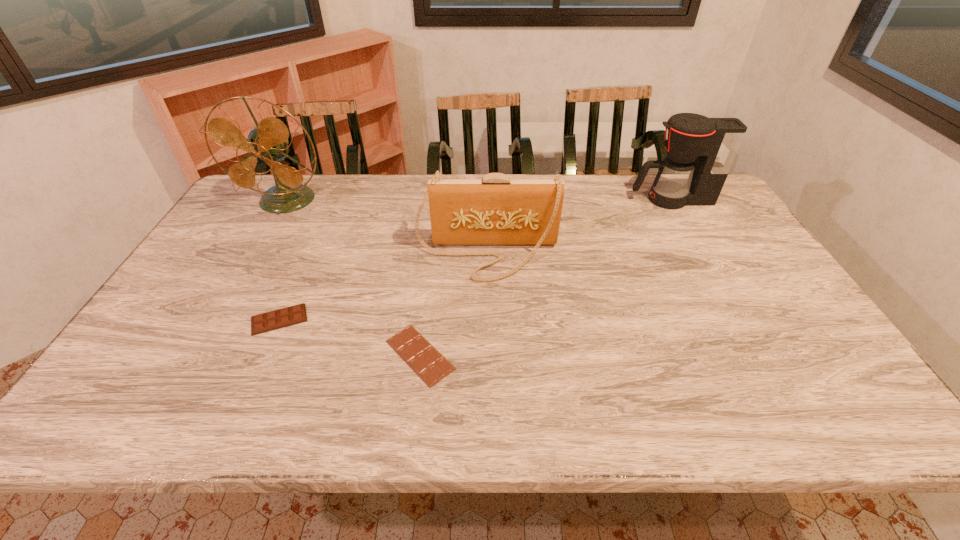
The image size is (960, 540). I want to click on object that is at the right edge, so click(700, 151).

Identify the location of object located in the far left corner section of the desktop. The image size is (960, 540). (268, 140).

Locate an element on the screen. The height and width of the screenshot is (540, 960). object that is positioned at the far right corner is located at coordinates (700, 151).

Locate an element on the screen. Image resolution: width=960 pixels, height=540 pixels. free region at the far edge of the desktop is located at coordinates (376, 202).

In the image, there is a desktop. At what (x,y) coordinates should I click in order to perform the action: click on vacant space at the near edge. Please return your answer as a coordinate pair (x, y). Looking at the image, I should click on (402, 395).

Locate an element on the screen. The image size is (960, 540). free location at the left edge is located at coordinates (157, 387).

I want to click on vacant space at the right edge, so click(844, 382).

Locate an element on the screen. This screenshot has height=540, width=960. vacant area at the far left corner is located at coordinates 252,195.

This screenshot has height=540, width=960. What are the coordinates of `free space at the far right corner` in the screenshot? It's located at (718, 199).

I want to click on blank region between the shortest object and the taller chocolate bar, so click(349, 337).